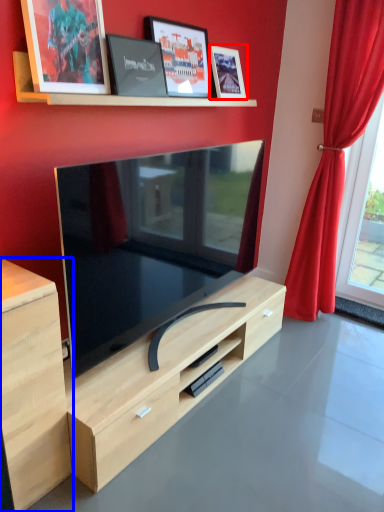
Question: Among these objects, which one is farthest to the camera, picture frame (highlighted by a red box) or cabinetry (highlighted by a blue box)?

Choices:
 (A) picture frame
 (B) cabinetry

Answer: (A)